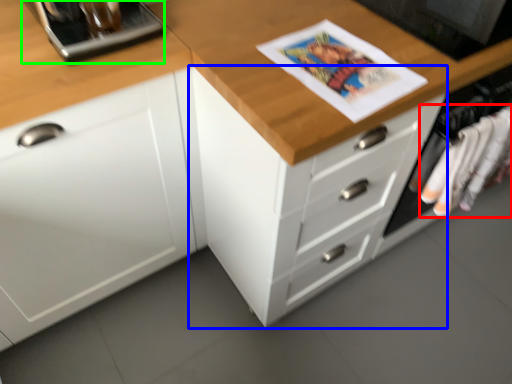
Question: Based on their relative distances, which object is farther from clothing (highlighted by a red box)? Choose from chest of drawers (highlighted by a blue box) and appliance (highlighted by a green box).

Choices:
 (A) chest of drawers
 (B) appliance

Answer: (B)